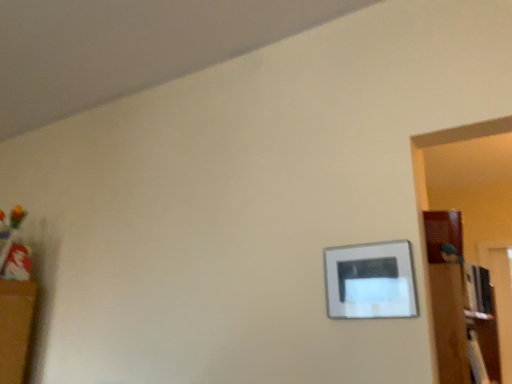
The image size is (512, 384). What do you see at coordinates (370, 281) in the screenshot?
I see `metallic silver thermostat at center` at bounding box center [370, 281].

This screenshot has height=384, width=512. Identify the location of metallic silver thermostat at center. tap(370, 281).

Identify the location of metallic silver thermostat at center. (370, 281).